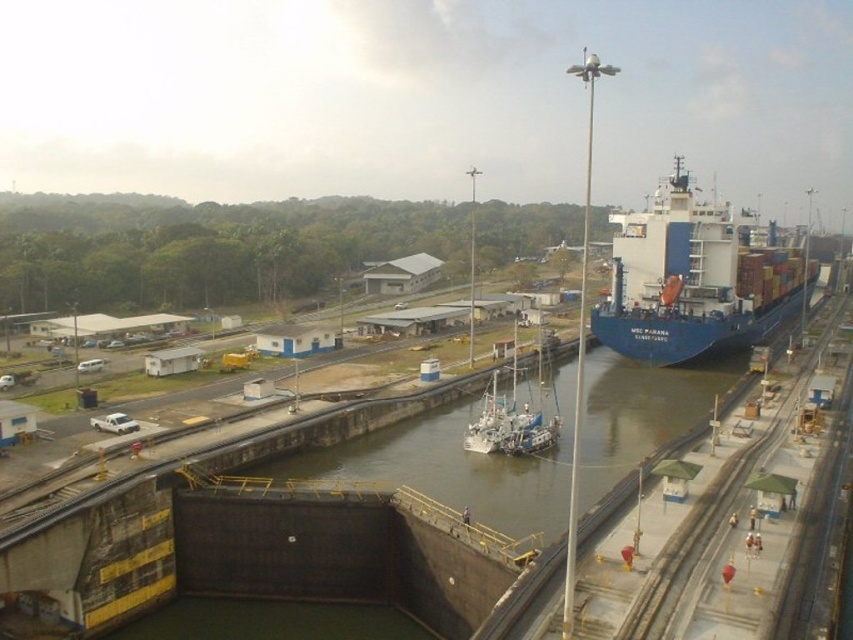
You are a canal engineer assessing the lock chamber capacity. The lock chamber can only accommodate one vessel at a time. Given the blue matte container ship at right and the white matte boat at center, which vessel would require the lock chamber to be adjusted to its dimensions?

The blue matte container ship at right would require the lock chamber to be adjusted to its dimensions since its width is larger than the white matte boat at center.

You are a crane operator tasked with loading cargo onto both the blue matte container ship at right and the white matte boat at center. Considering their heights, which vessel requires a crane with a taller reach to safely load containers without hitting the ship or boat?

The blue matte container ship at right has a greater height compared to the white matte boat at center, so the crane operator should use a taller crane to load the blue matte container ship at right.